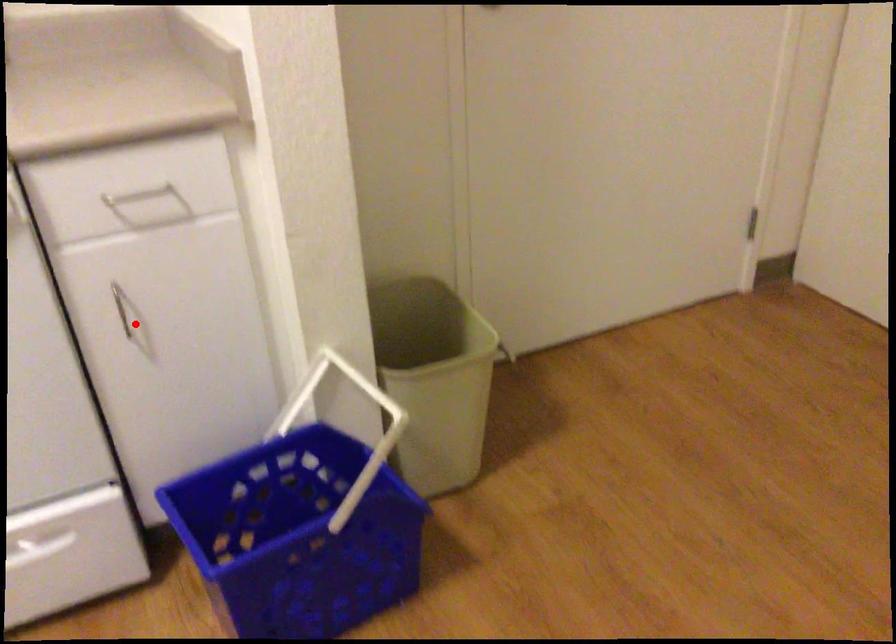
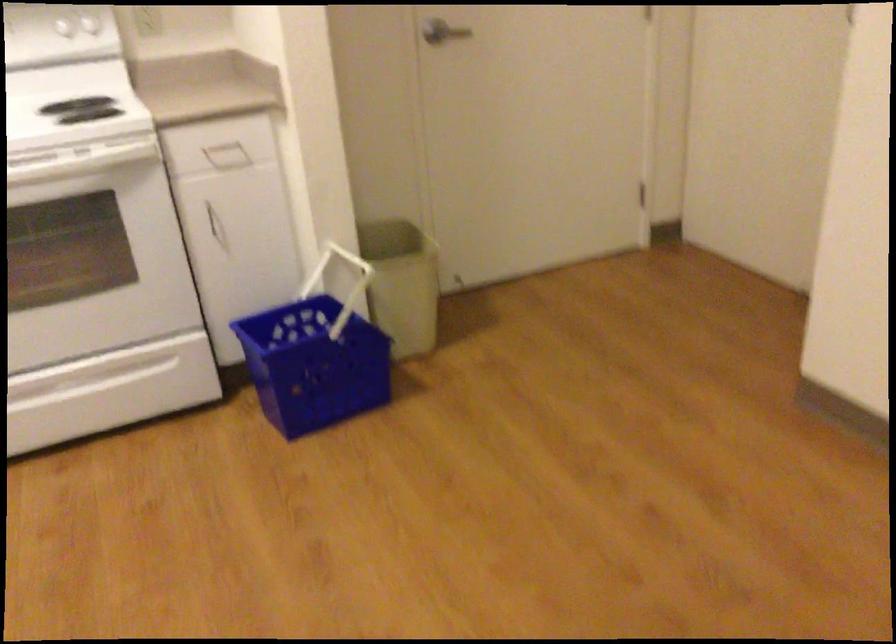
Find the pixel in the second image that matches the highlighted location in the first image.

(216, 225)